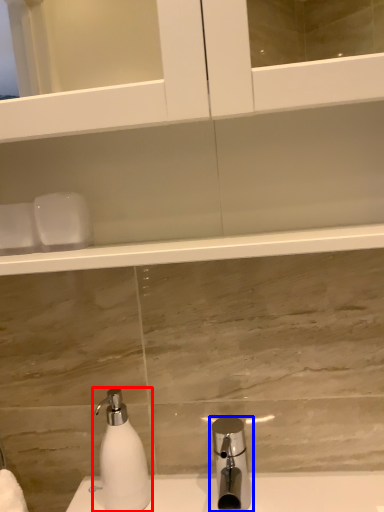
Question: Which object appears farthest to the camera in this image, soap dispenser (highlighted by a red box) or tap (highlighted by a blue box)?

Choices:
 (A) soap dispenser
 (B) tap

Answer: (A)